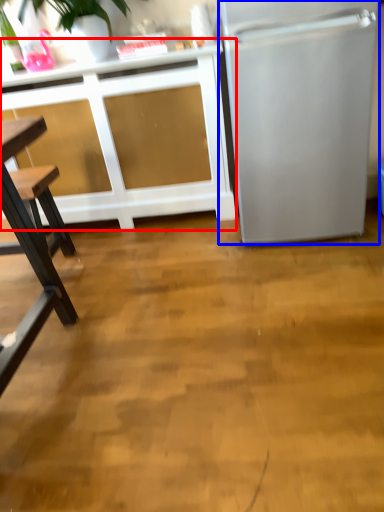
Question: Which of the following is the farthest to the observer, cabinetry (highlighted by a red box) or refrigerator (highlighted by a blue box)?

Choices:
 (A) cabinetry
 (B) refrigerator

Answer: (A)